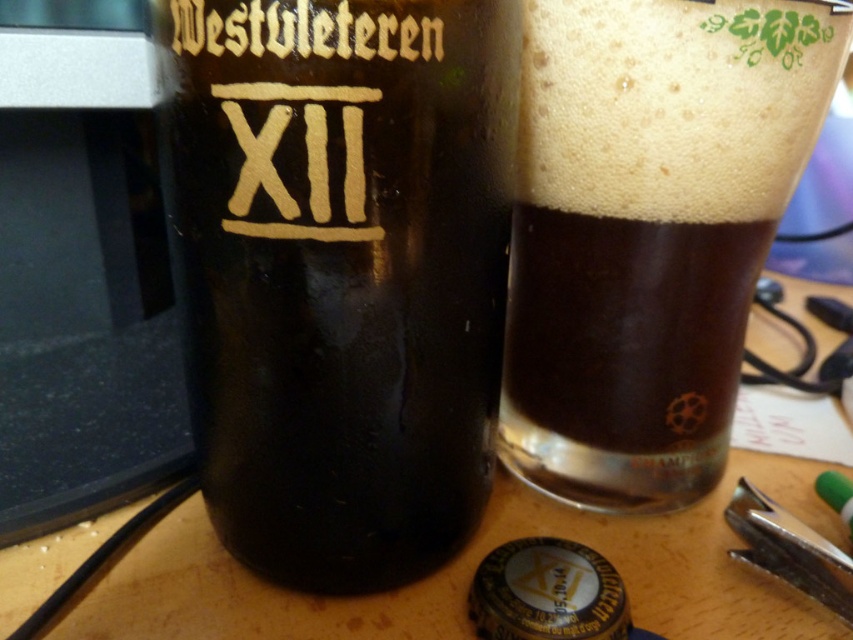
Question: Which point is farther to the camera?

Choices:
 (A) (276, 134)
 (B) (572, 150)

Answer: (B)

Question: Which point is closer to the camera?

Choices:
 (A) (520, 358)
 (B) (505, 256)

Answer: (B)

Question: Is matte glass bottle at center further to the viewer compared to dark brown glass at upper center?

Choices:
 (A) no
 (B) yes

Answer: (A)

Question: Can you confirm if matte glass bottle at center is positioned above dark brown glass at upper center?

Choices:
 (A) no
 (B) yes

Answer: (A)

Question: Does matte glass bottle at center have a smaller size compared to dark brown glass at upper center?

Choices:
 (A) yes
 (B) no

Answer: (A)

Question: Which point is farther to the camera?

Choices:
 (A) (614, 184)
 (B) (466, 225)

Answer: (A)